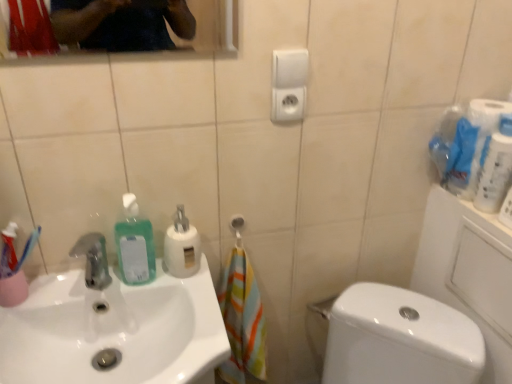
Question: Can you confirm if white glossy toilet paper at upper right is thinner than white glossy toilet at lower right?

Choices:
 (A) no
 (B) yes

Answer: (B)

Question: From the image's perspective, is white glossy toilet paper at upper right beneath white glossy toilet at lower right?

Choices:
 (A) no
 (B) yes

Answer: (A)

Question: Does white glossy toilet paper at upper right appear on the left side of white glossy toilet at lower right?

Choices:
 (A) yes
 (B) no

Answer: (B)

Question: Can you confirm if white glossy toilet paper at upper right is smaller than white glossy toilet at lower right?

Choices:
 (A) yes
 (B) no

Answer: (A)

Question: Considering the relative sizes of white glossy toilet paper at upper right and white glossy toilet at lower right in the image provided, is white glossy toilet paper at upper right taller than white glossy toilet at lower right?

Choices:
 (A) yes
 (B) no

Answer: (B)

Question: Can you confirm if white glossy toilet paper at upper right is wider than white glossy toilet at lower right?

Choices:
 (A) no
 (B) yes

Answer: (A)

Question: Does white glossy sink at lower left lie in front of green translucent liquid at sink left, arranged as the first cleaning product when viewed from the left?

Choices:
 (A) yes
 (B) no

Answer: (A)

Question: From a real-world perspective, is white glossy sink at lower left located higher than green translucent liquid at sink left, positioned as the second cleaning product in right-to-left order?

Choices:
 (A) no
 (B) yes

Answer: (A)

Question: Can you confirm if white glossy sink at lower left is smaller than green translucent liquid at sink left, arranged as the first cleaning product when viewed from the left?

Choices:
 (A) no
 (B) yes

Answer: (A)

Question: Are white glossy sink at lower left and green translucent liquid at sink left, arranged as the first cleaning product when viewed from the left, located far from each other?

Choices:
 (A) no
 (B) yes

Answer: (A)

Question: Considering the relative positions of white glossy sink at lower left and green translucent liquid at sink left, arranged as the first cleaning product when viewed from the left, in the image provided, is white glossy sink at lower left to the right of green translucent liquid at sink left, arranged as the first cleaning product when viewed from the left, from the viewer's perspective?

Choices:
 (A) no
 (B) yes

Answer: (A)

Question: Is white glossy sink at lower left oriented towards green translucent liquid at sink left, positioned as the second cleaning product in right-to-left order?

Choices:
 (A) no
 (B) yes

Answer: (A)

Question: Would you say white glossy sink at lower left is part of white glossy toilet at lower right's contents?

Choices:
 (A) yes
 (B) no

Answer: (B)